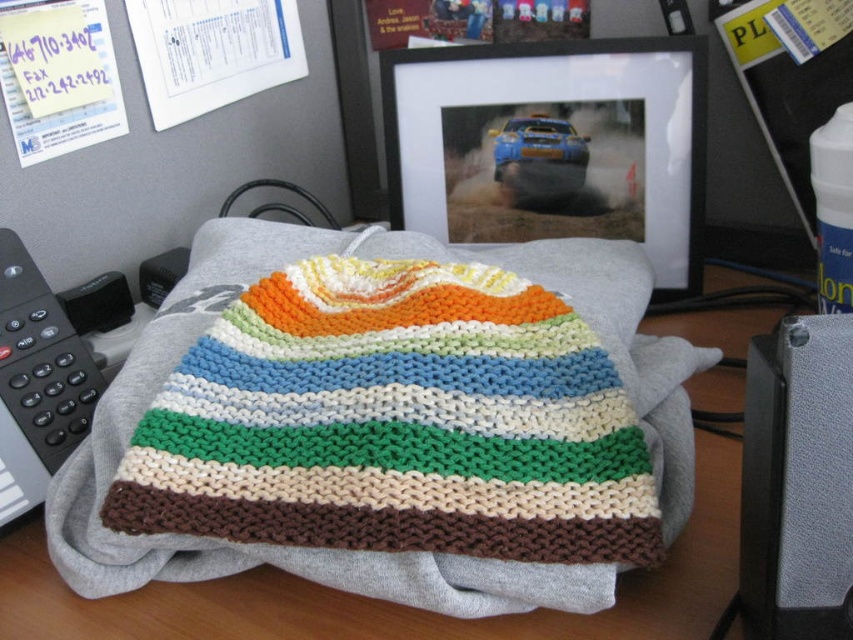
Question: Considering the relative positions of gray fabric at center and gray textured speaker at lower right in the image provided, where is gray fabric at center located with respect to gray textured speaker at lower right?

Choices:
 (A) right
 (B) left

Answer: (B)

Question: Which of the following is the closest to the observer?

Choices:
 (A) (820, 486)
 (B) (688, 344)

Answer: (A)

Question: Which of the following is the closest to the observer?

Choices:
 (A) (801, 572)
 (B) (88, 476)

Answer: (A)

Question: Does gray fabric at center come in front of gray textured speaker at lower right?

Choices:
 (A) no
 (B) yes

Answer: (A)

Question: Does gray fabric at center have a smaller size compared to gray textured speaker at lower right?

Choices:
 (A) no
 (B) yes

Answer: (A)